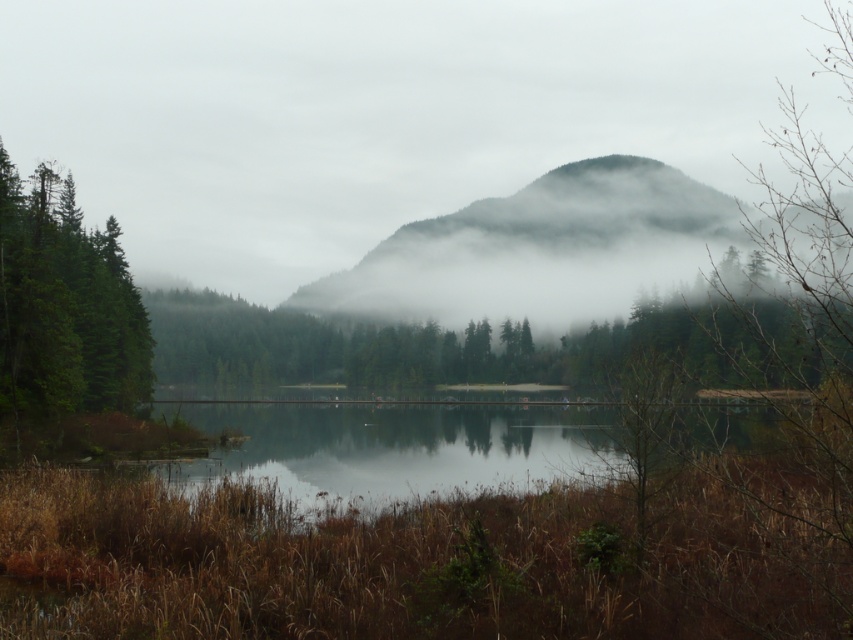
In the scene shown: You are standing at the point closer to the camera between the two points, point (296, 248) and point (79, 236). Which point are you standing at?

You are standing at point (79, 236) because it is closer to the camera than point (296, 248).

You are an adventurer trying to determine the best path to reach the summit. You see the foggy misty mountain at center and the foggy forested mountain at center. Which mountain is higher in elevation?

The foggy misty mountain at center is positioned over the foggy forested mountain at center, indicating it is higher in elevation.